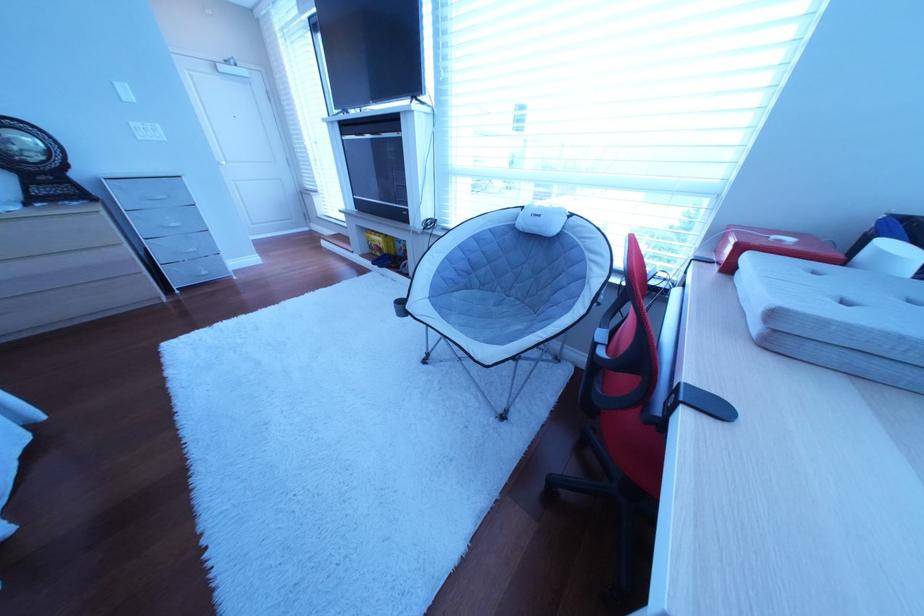
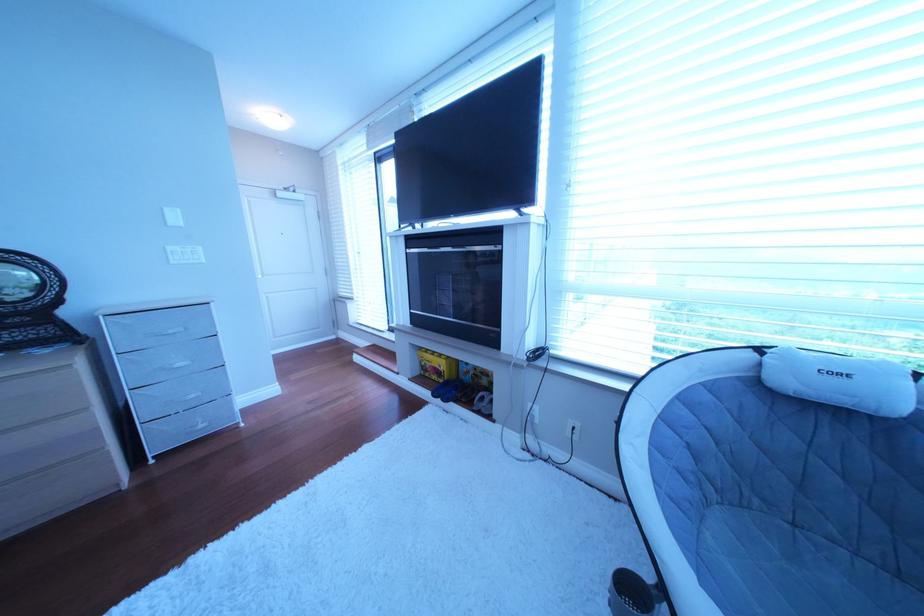
Where in the second image is the point corresponding to the point at 128,84 from the first image?

(177, 211)